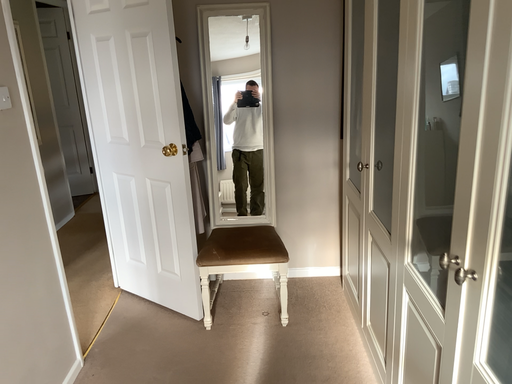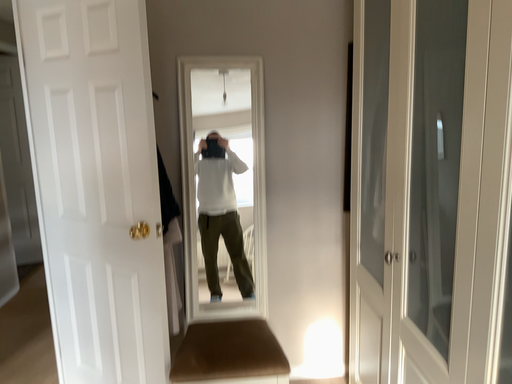
Question: Which way did the camera rotate in the video?

Choices:
 (A) rotated upward
 (B) rotated downward

Answer: (A)